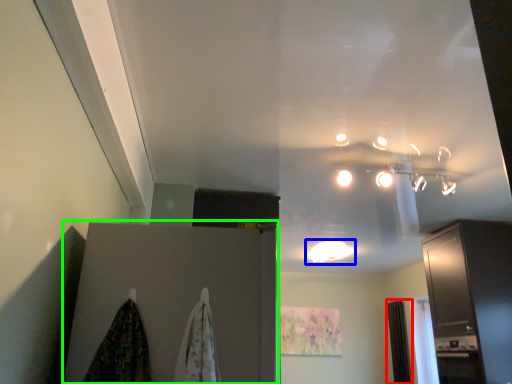
Question: Which is farther away from curtain (highlighted by a red box)? lighting (highlighted by a blue box) or door (highlighted by a green box)?

Choices:
 (A) lighting
 (B) door

Answer: (B)